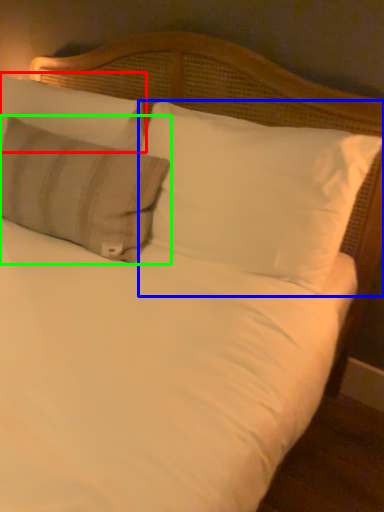
Question: Considering the real-world distances, which object is farthest from pillow (highlighted by a red box)? pillow (highlighted by a blue box) or pillow (highlighted by a green box)?

Choices:
 (A) pillow
 (B) pillow

Answer: (A)